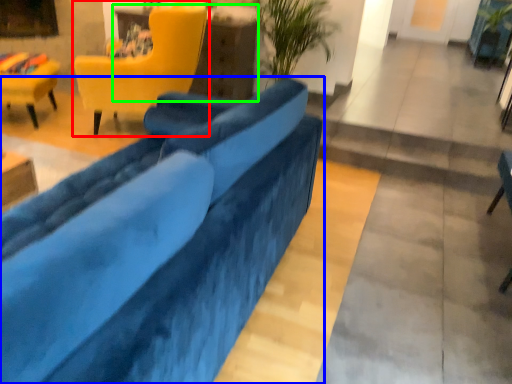
Question: Which object is the closest to the chair (highlighted by a red box)? Choose among these: studio couch (highlighted by a blue box) or table (highlighted by a green box).

Choices:
 (A) studio couch
 (B) table

Answer: (B)